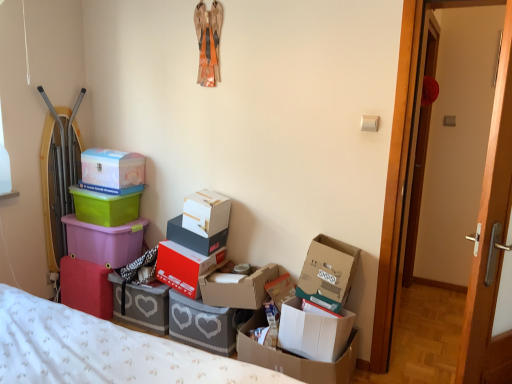
Question: Which direction should I rotate to look at matte white cardboard box at center, which is counted as the sixth box, starting from the left, — up or down?

Choices:
 (A) up
 (B) down

Answer: (B)

Question: Is white cardboard box at lower right, the second box when ordered from right to left, looking in the opposite direction of matte wood door at right, which ranks as the second door in back-to-front order?

Choices:
 (A) yes
 (B) no

Answer: (B)

Question: From a real-world perspective, is white cardboard box at lower right, which ranks as the 11th box in left-to-right order, located higher than matte wood door at right, which ranks as the second door in back-to-front order?

Choices:
 (A) no
 (B) yes

Answer: (A)

Question: Is the depth of white cardboard box at lower right, which ranks as the 11th box in left-to-right order, greater than that of matte wood door at right, which appears as the 1th door when viewed from the front?

Choices:
 (A) yes
 (B) no

Answer: (A)

Question: Is white cardboard box at lower right, the second box when ordered from right to left, thinner than matte wood door at right, which appears as the 1th door when viewed from the front?

Choices:
 (A) no
 (B) yes

Answer: (A)

Question: From the image's perspective, is white cardboard box at lower right, the second box when ordered from right to left, beneath matte wood door at right, which ranks as the second door in back-to-front order?

Choices:
 (A) no
 (B) yes

Answer: (B)

Question: Can you confirm if white cardboard box at lower right, which ranks as the 11th box in left-to-right order, is positioned to the right of matte wood door at right, which appears as the 1th door when viewed from the front?

Choices:
 (A) yes
 (B) no

Answer: (B)

Question: Does green plastic container at upper left, positioned as the 11th box in right-to-left order, have a greater width compared to gray cardboard box at lower center, positioned as the 4th box in left-to-right order?

Choices:
 (A) yes
 (B) no

Answer: (B)

Question: From the image's perspective, is green plastic container at upper left, which is the 2th box from left to right, beneath gray cardboard box at lower center, the 9th box from the right?

Choices:
 (A) yes
 (B) no

Answer: (B)

Question: From a real-world perspective, is green plastic container at upper left, positioned as the 11th box in right-to-left order, located beneath gray cardboard box at lower center, the 9th box from the right?

Choices:
 (A) no
 (B) yes

Answer: (A)

Question: Is green plastic container at upper left, positioned as the 11th box in right-to-left order, positioned far away from gray cardboard box at lower center, the 9th box from the right?

Choices:
 (A) yes
 (B) no

Answer: (B)

Question: Considering the relative sizes of green plastic container at upper left, positioned as the 11th box in right-to-left order, and gray cardboard box at lower center, the 9th box from the right, in the image provided, is green plastic container at upper left, positioned as the 11th box in right-to-left order, smaller than gray cardboard box at lower center, the 9th box from the right,?

Choices:
 (A) no
 (B) yes

Answer: (B)

Question: Is green plastic container at upper left, which is the 2th box from left to right, oriented towards gray cardboard box at lower center, the 9th box from the right?

Choices:
 (A) yes
 (B) no

Answer: (B)

Question: From a real-world perspective, is green plastic container at upper left, which is the 2th box from left to right, below cardboard box at right, which is counted as the 12th box, starting from the left?

Choices:
 (A) no
 (B) yes

Answer: (A)